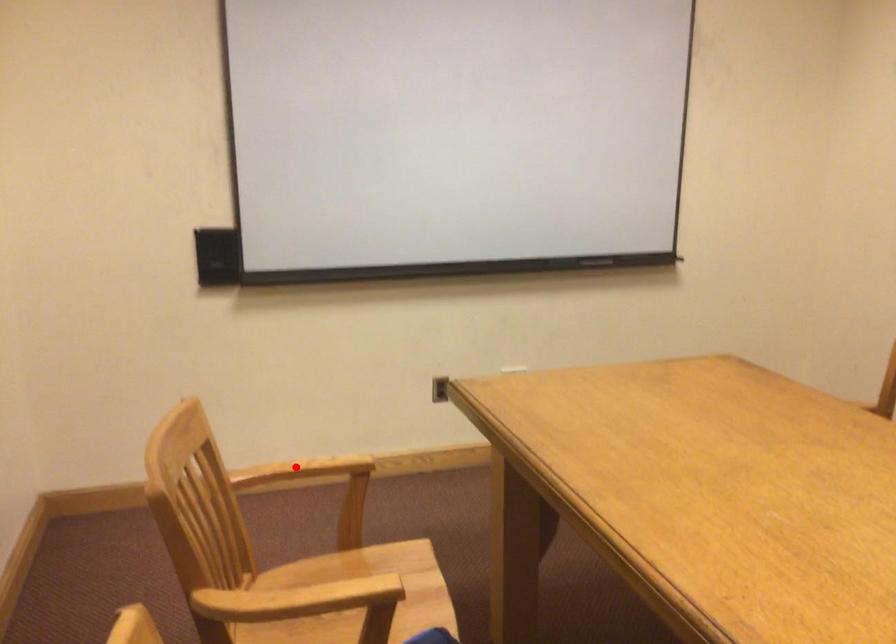
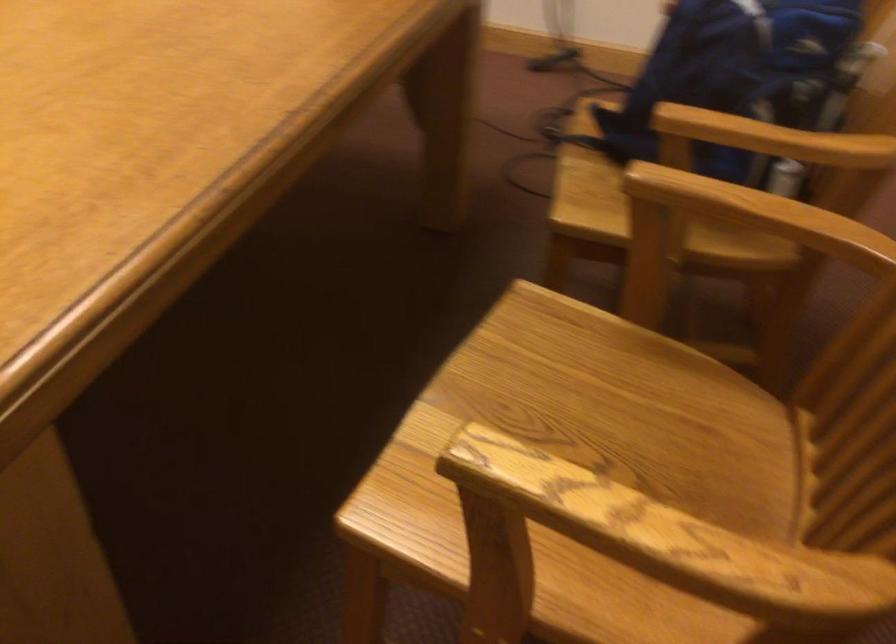
Question: A red point is marked in image1. In image2, is the corresponding 3D point closer to the camera or farther? Reply with the corresponding letter.

Choices:
 (A) The corresponding 3D point is closer.
 (B) The corresponding 3D point is farther.

Answer: (A)